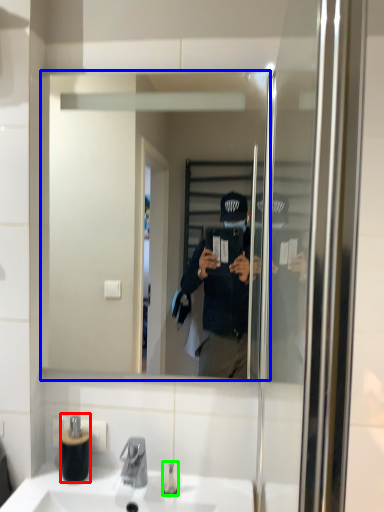
Question: Based on their relative distances, which object is nearer to bottle (highlighted by a red box)? Choose from mirror (highlighted by a blue box) and toiletry (highlighted by a green box).

Choices:
 (A) mirror
 (B) toiletry

Answer: (B)